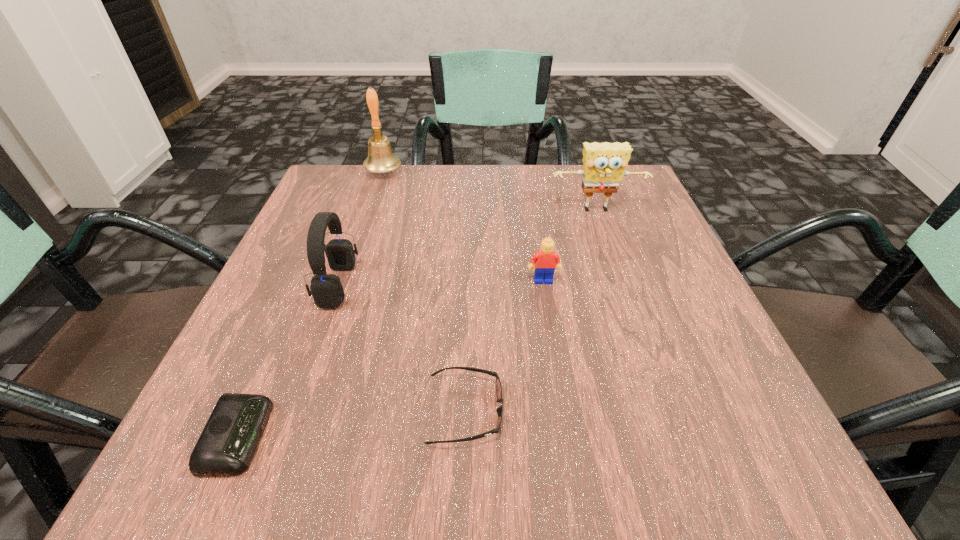
I want to click on vacant position located 0.160m on the face of the rightmost object, so click(x=617, y=269).

Identify the location of free point located 0.070m on the headband of the headset. (394, 285).

The height and width of the screenshot is (540, 960). What are the coordinates of `vacant space located on the face of the third shortest object` in the screenshot? It's located at (575, 482).

The height and width of the screenshot is (540, 960). What are the coordinates of `free spot located 0.300m on the front-facing side of the sunglasses` in the screenshot? It's located at (722, 411).

I want to click on vacant space located on the display of the alarm clock, so click(569, 436).

The width and height of the screenshot is (960, 540). Find the location of `bell that is positioned at the far edge`. bell that is positioned at the far edge is located at coordinates tap(380, 159).

At what (x,y) coordinates should I click in order to perform the action: click on sponge that is at the far edge. Please return your answer as a coordinate pair (x, y). The width and height of the screenshot is (960, 540). Looking at the image, I should click on (604, 164).

Locate an element on the screen. sunglasses present at the near edge is located at coordinates (498, 387).

Find the location of a particular element. alarm clock at the near edge is located at coordinates (229, 440).

Where is `bell present at the left edge`? This screenshot has height=540, width=960. bell present at the left edge is located at coordinates (380, 159).